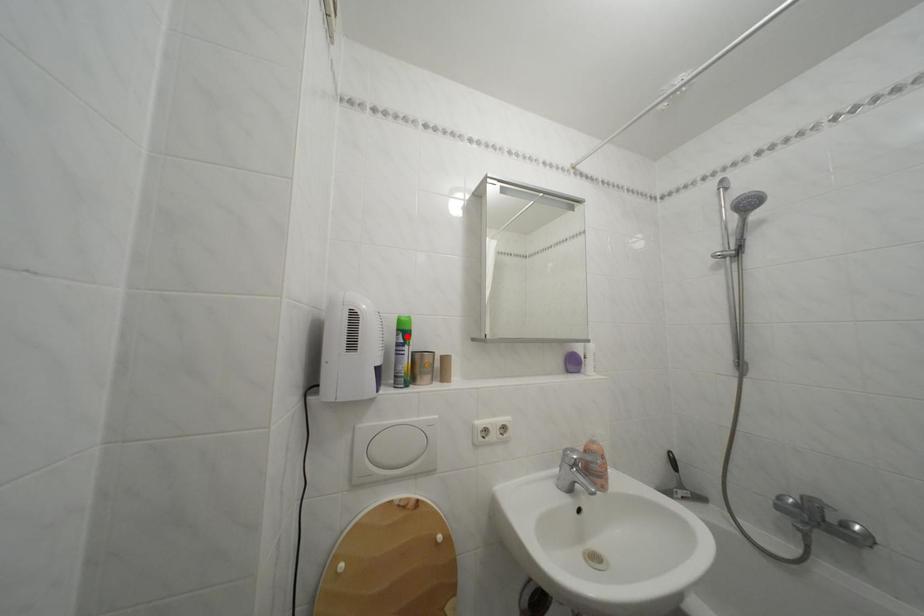
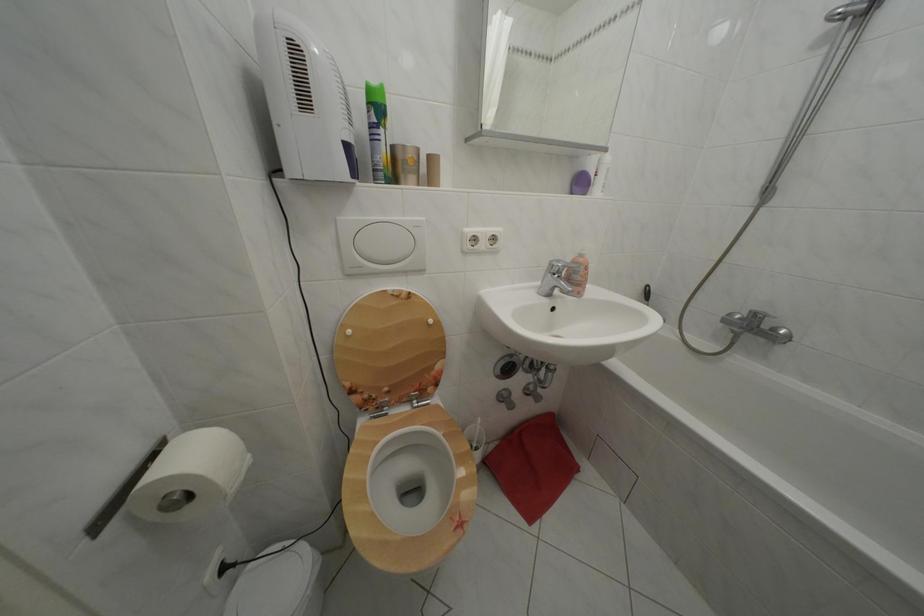
Locate, in the second image, the point that corresponds to the highlighted location in the first image.

(378, 110)